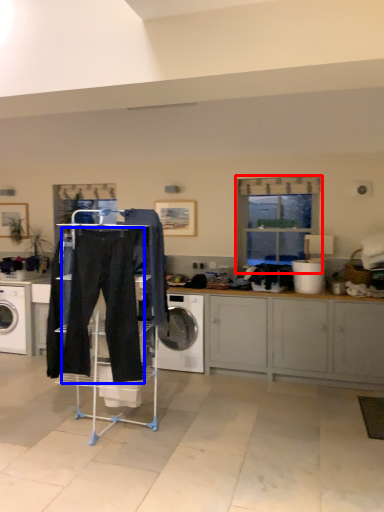
Question: Which object appears farthest to the camera in this image, window (highlighted by a red box) or sweat pant (highlighted by a blue box)?

Choices:
 (A) window
 (B) sweat pant

Answer: (A)